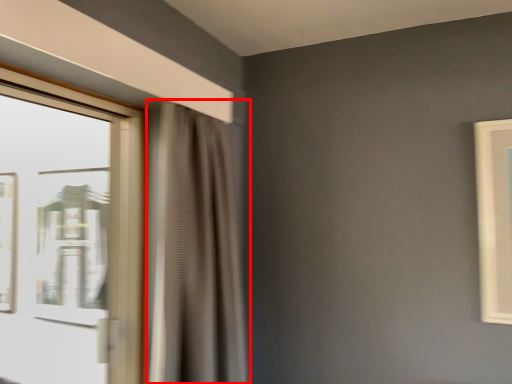
Question: From the image's perspective, where is curtain (annotated by the red box) located in relation to window in the image?

Choices:
 (A) above
 (B) below

Answer: (B)